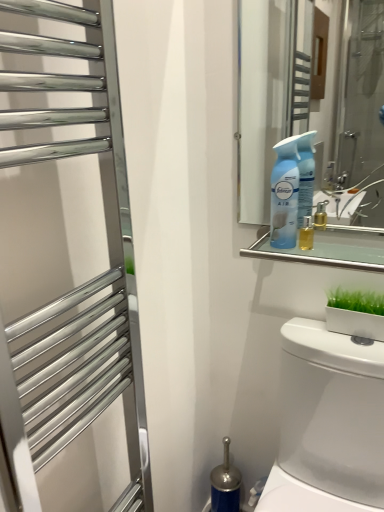
Identify the location of clear glass mirror at upper center. The height and width of the screenshot is (512, 384). click(x=330, y=248).

This screenshot has width=384, height=512. What do you see at coordinates (328, 422) in the screenshot?
I see `white glossy toilet at lower right` at bounding box center [328, 422].

Find the location of a particular element. The height and width of the screenshot is (512, 384). polished chrome towel rack at left is located at coordinates (87, 282).

In order to face polished chrome towel rack at left, should I rotate leftwards or rightwards?

Rotate left and turn 12.174 degrees.

Locate an element on the screen. The image size is (384, 512). clear glass mirror at upper center is located at coordinates (330, 248).

Image resolution: width=384 pixels, height=512 pixels. Find the location of `toilet that appears below the green matte planter at lower right (from the image's perspective)`. toilet that appears below the green matte planter at lower right (from the image's perspective) is located at coordinates (328, 422).

Which is in front, green matte planter at lower right or white glossy toilet at lower right?

white glossy toilet at lower right is closer to the camera.

Consider the image. Between green matte planter at lower right and white glossy toilet at lower right, which one appears on the left side from the viewer's perspective?

From the viewer's perspective, white glossy toilet at lower right appears more on the left side.

Is clear glass mirror at upper center next to white glossy toilet at lower right and touching it?

No, clear glass mirror at upper center is not making contact with white glossy toilet at lower right.

Which is in front, point (253, 256) or point (290, 348)?

The point (290, 348) is closer.

Is clear glass mirror at upper center aimed at white glossy toilet at lower right?

No, clear glass mirror at upper center is not facing towards white glossy toilet at lower right.

Where is `balustrade above the white glossy toilet at lower right (from the image's perspective)`? The width and height of the screenshot is (384, 512). balustrade above the white glossy toilet at lower right (from the image's perspective) is located at coordinates (330, 248).

Measure the distance from blue plastic spray bottle at upper right to polished chrome towel rack at left.

blue plastic spray bottle at upper right is 18.76 inches away from polished chrome towel rack at left.

From a real-world perspective, who is located lower, blue plastic spray bottle at upper right or polished chrome towel rack at left?

polished chrome towel rack at left.

Considering the relative sizes of blue plastic spray bottle at upper right and polished chrome towel rack at left in the image provided, is blue plastic spray bottle at upper right smaller than polished chrome towel rack at left?

Correct, blue plastic spray bottle at upper right occupies less space than polished chrome towel rack at left.

Is blue plastic spray bottle at upper right placed right next to polished chrome towel rack at left?

blue plastic spray bottle at upper right is not next to polished chrome towel rack at left, and they're not touching.

Can you confirm if green matte planter at lower right is positioned to the left of clear glass mirror at upper center?

Incorrect, green matte planter at lower right is not on the left side of clear glass mirror at upper center.

From the image's perspective, which object appears higher, green matte planter at lower right or clear glass mirror at upper center?

From the image's view, clear glass mirror at upper center is above.

Could clear glass mirror at upper center be considered to be inside green matte planter at lower right?

Actually, clear glass mirror at upper center is outside green matte planter at lower right.

Is clear glass mirror at upper center closer to camera compared to polished chrome towel rack at left?

That is False.

From a real-world perspective, is clear glass mirror at upper center positioned above or below polished chrome towel rack at left?

From a real-world perspective, clear glass mirror at upper center is physically above polished chrome towel rack at left.

Who is smaller, clear glass mirror at upper center or polished chrome towel rack at left?

Smaller between the two is clear glass mirror at upper center.

Between clear glass mirror at upper center and polished chrome towel rack at left, which one has more height?

Standing taller between the two is polished chrome towel rack at left.

In the scene shown: Between blue plastic spray bottle at upper right and clear glass mirror at upper center, which one has smaller width?

blue plastic spray bottle at upper right.

Is blue plastic spray bottle at upper right smaller than clear glass mirror at upper center?

Actually, blue plastic spray bottle at upper right might be larger than clear glass mirror at upper center.

Is blue plastic spray bottle at upper right not close to clear glass mirror at upper center?

blue plastic spray bottle at upper right is actually quite close to clear glass mirror at upper center.

From a real-world perspective, between green matte planter at lower right and polished chrome towel rack at left, who is vertically lower?

green matte planter at lower right is physically lower.

Between green matte planter at lower right and polished chrome towel rack at left, which one appears on the left side from the viewer's perspective?

From the viewer's perspective, polished chrome towel rack at left appears more on the left side.

Between point (369, 293) and point (43, 335), which one is positioned in front?

The point (43, 335) is closer.

This screenshot has height=512, width=384. Find the location of `plant that appears above the white glossy toilet at lower right (from a real-world perspective)`. plant that appears above the white glossy toilet at lower right (from a real-world perspective) is located at coordinates (356, 301).

This screenshot has width=384, height=512. I want to click on toilet in front of the clear glass mirror at upper center, so click(x=328, y=422).

Based on their spatial positions, is blue plastic spray bottle at upper right or clear glass mirror at upper center further from white glossy toilet at lower right?

blue plastic spray bottle at upper right.

Estimate the real-world distances between objects in this image. Which object is further from polished chrome towel rack at left, green matte planter at lower right or white glossy toilet at lower right?

green matte planter at lower right is further to polished chrome towel rack at left.

Which object lies further to the anchor point polished chrome towel rack at left, clear glass mirror at upper center or white glossy toilet at lower right?

The object further to polished chrome towel rack at left is clear glass mirror at upper center.

Estimate the real-world distances between objects in this image. Which object is further from blue plastic spray bottle at upper right, clear glass mirror at upper center or polished chrome towel rack at left?

polished chrome towel rack at left lies further to blue plastic spray bottle at upper right than the other object.

Which object lies nearer to the anchor point clear glass mirror at upper center, polished chrome towel rack at left or white glossy toilet at lower right?

white glossy toilet at lower right.

Which object lies nearer to the anchor point green matte planter at lower right, white glossy toilet at lower right or blue plastic spray bottle at upper right?

white glossy toilet at lower right lies closer to green matte planter at lower right than the other object.

Based on their spatial positions, is polished chrome towel rack at left or green matte planter at lower right closer to clear glass mirror at upper center?

Based on the image, green matte planter at lower right appears to be nearer to clear glass mirror at upper center.

Estimate the real-world distances between objects in this image. Which object is further from green matte planter at lower right, polished chrome towel rack at left or clear glass mirror at upper center?

polished chrome towel rack at left lies further to green matte planter at lower right than the other object.

I want to click on balustrade that lies between blue plastic spray bottle at upper right and white glossy toilet at lower right from top to bottom, so click(330, 248).

The image size is (384, 512). I want to click on toilet between polished chrome towel rack at left and green matte planter at lower right along the z-axis, so click(328, 422).

Identify the location of screen door between blue plastic spray bottle at upper right and white glossy toilet at lower right from top to bottom. The image size is (384, 512). (87, 282).

Where is `plant between clear glass mirror at upper center and white glossy toilet at lower right in the up-down direction`? The width and height of the screenshot is (384, 512). plant between clear glass mirror at upper center and white glossy toilet at lower right in the up-down direction is located at coordinates (356, 301).